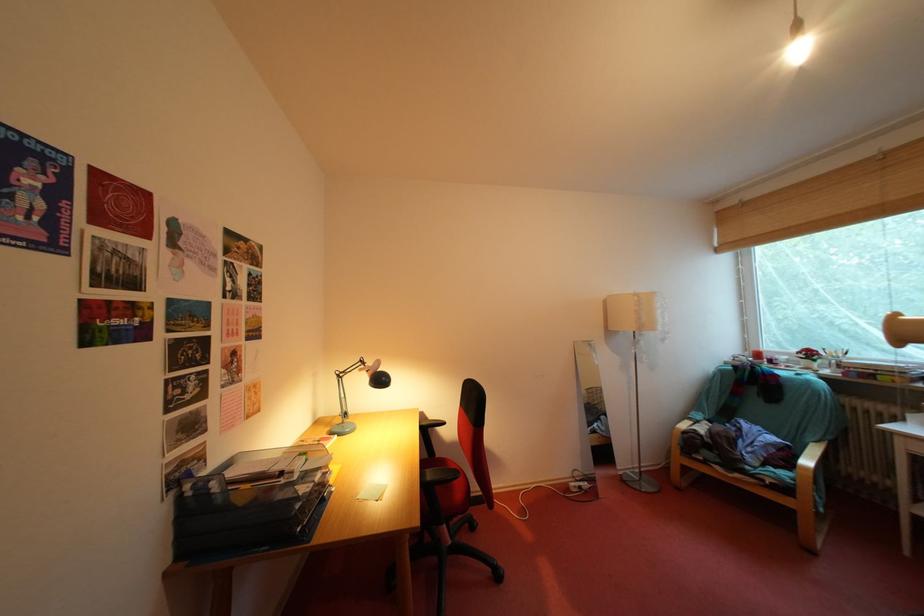
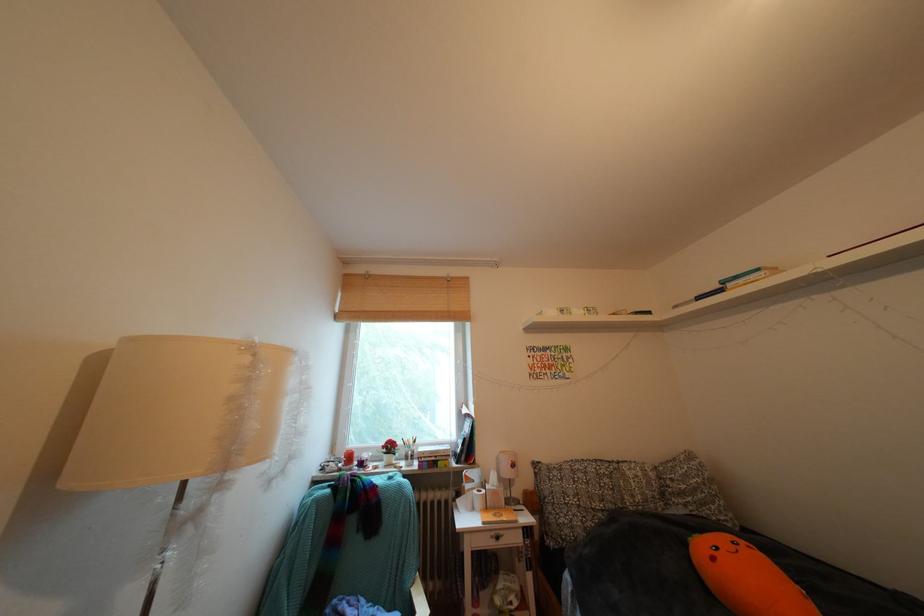
The point at (x=648, y=301) is marked in the first image. Where is the corresponding point in the second image?

(259, 353)